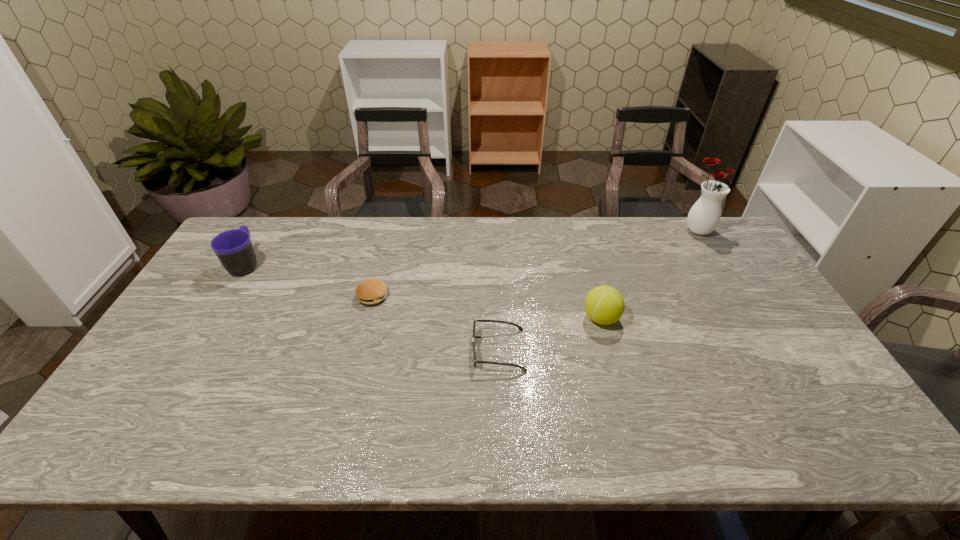
Locate an element on the screen. The width and height of the screenshot is (960, 540). the rightmost object is located at coordinates tap(704, 216).

In order to click on the farthest object in this screenshot , I will do `click(704, 216)`.

What are the coordinates of `mug` in the screenshot? It's located at (234, 249).

Image resolution: width=960 pixels, height=540 pixels. I want to click on the leftmost object, so click(234, 249).

Locate an element on the screen. the second object from right to left is located at coordinates (x=604, y=305).

The height and width of the screenshot is (540, 960). In order to click on spectacles in this screenshot , I will do `click(520, 328)`.

Where is `the fourth object from right to left`? This screenshot has width=960, height=540. the fourth object from right to left is located at coordinates (371, 291).

What are the coordinates of `vacant space located on the front of the rightmost object` in the screenshot? It's located at click(x=725, y=276).

Where is `vacant position located 0.060m with the handle on the side of the leftmost object`? vacant position located 0.060m with the handle on the side of the leftmost object is located at coordinates (261, 239).

Find the location of a particular element. The height and width of the screenshot is (540, 960). vacant area situated 0.050m with the handle on the side of the leftmost object is located at coordinates (260, 240).